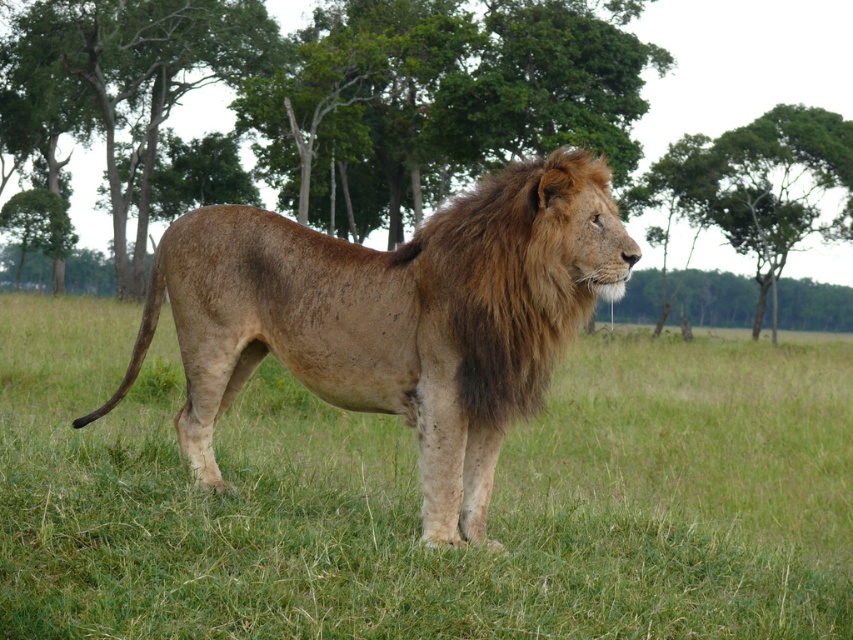
From the picture: Between brown fur lion at center and green leafy tree at center, which one appears on the right side from the viewer's perspective?

From the viewer's perspective, green leafy tree at center appears more on the right side.

Which is above, brown fur lion at center or green leafy tree at center?

green leafy tree at center is above.

Between point (300, 228) and point (802, 49), which one is positioned behind?

Point (802, 49)

Locate an element on the screen. brown fur lion at center is located at coordinates (395, 317).

What do you see at coordinates (419, 499) in the screenshot?
I see `green grass at center` at bounding box center [419, 499].

Is green grass at center shorter than green leafy tree at center?

Indeed, green grass at center has a lesser height compared to green leafy tree at center.

Is point (194, 628) in front of point (799, 51)?

Yes, point (194, 628) is in front of point (799, 51).

In order to click on green grass at center in this screenshot , I will do tap(419, 499).

Does green grass at center appear over brown fur lion at center?

Actually, green grass at center is below brown fur lion at center.

Does green grass at center have a lesser height compared to brown fur lion at center?

In fact, green grass at center may be taller than brown fur lion at center.

Where is `green grass at center`? This screenshot has height=640, width=853. green grass at center is located at coordinates (419, 499).